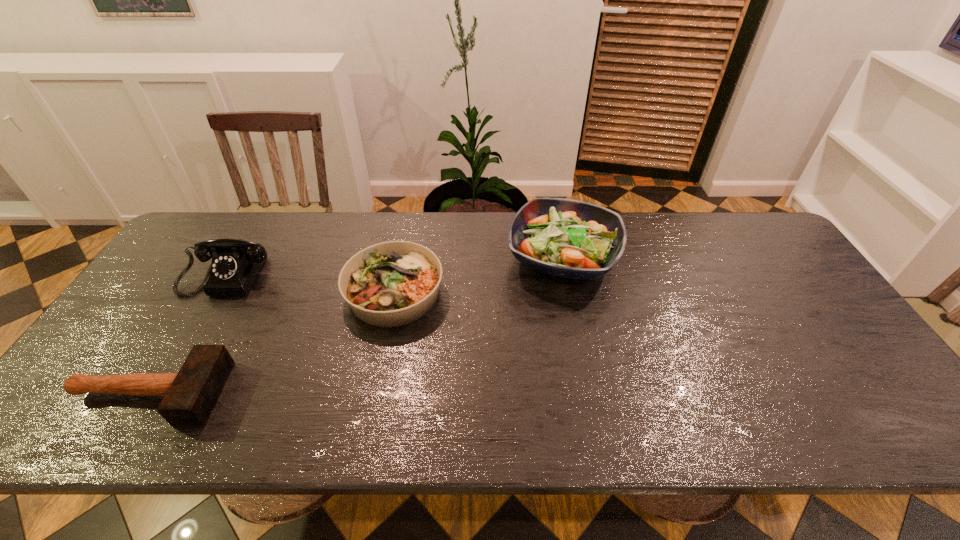
I want to click on vacant area that lies between the left salad plate and the shortest object, so click(272, 343).

Image resolution: width=960 pixels, height=540 pixels. I want to click on empty location between the telephone and the shorter salad plate, so click(313, 282).

Choose which object is the nearest neighbor to the telephone. Please provide its 2D coordinates. Your answer should be formatted as a tuple, i.e. [(x, y)], where the tuple contains the x and y coordinates of a point satisfying the conditions above.

[(189, 396)]

I want to click on object that is the nearest to the nearest object, so click(236, 263).

Identify the location of vacant space that satisfies the following two spatial constraints: 1. on the dial of the left salad plate; 2. on the right side of the telephone. (219, 293).

Locate an element on the screen. vacant region that satisfies the following two spatial constraints: 1. on the dial of the second object from right to left; 2. on the right side of the telephone is located at coordinates (219, 293).